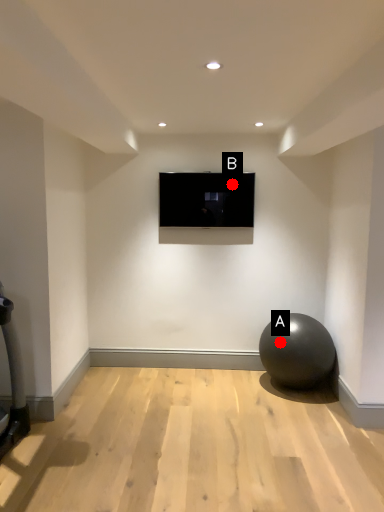
Question: Two points are circled on the image, labeled by A and B beside each circle. Which point is farther to the camera?

Choices:
 (A) A is further
 (B) B is further

Answer: (B)